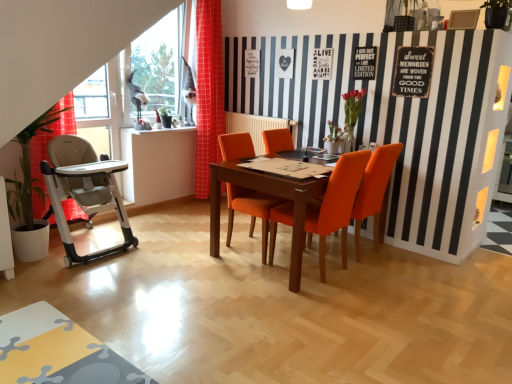
Question: Considering the relative sizes of orange fabric chair at center, the 3th chair positioned from the left, and red checkered curtain at left in the image provided, is orange fabric chair at center, the 3th chair positioned from the left, taller than red checkered curtain at left?

Choices:
 (A) yes
 (B) no

Answer: (B)

Question: Can you confirm if orange fabric chair at center, the 3th chair positioned from the left, is bigger than red checkered curtain at left?

Choices:
 (A) yes
 (B) no

Answer: (A)

Question: Considering the relative positions of orange fabric chair at center, which ranks as the first chair in right-to-left order, and red checkered curtain at left in the image provided, is orange fabric chair at center, which ranks as the first chair in right-to-left order, to the left of red checkered curtain at left from the viewer's perspective?

Choices:
 (A) no
 (B) yes

Answer: (A)

Question: Would you say orange fabric chair at center, the 3th chair positioned from the left, contains red checkered curtain at left?

Choices:
 (A) yes
 (B) no

Answer: (B)

Question: Can you confirm if orange fabric chair at center, which ranks as the first chair in right-to-left order, is thinner than red checkered curtain at left?

Choices:
 (A) yes
 (B) no

Answer: (B)

Question: From a real-world perspective, is orange fabric chair at center, which ranks as the first chair in right-to-left order, located higher than red checkered curtain at left?

Choices:
 (A) yes
 (B) no

Answer: (B)

Question: Considering the relative sizes of orange fabric chair at center, which ranks as the first chair in right-to-left order, and orange fabric chair at center, the second chair viewed from the left, in the image provided, is orange fabric chair at center, which ranks as the first chair in right-to-left order, bigger than orange fabric chair at center, the second chair viewed from the left,?

Choices:
 (A) yes
 (B) no

Answer: (B)

Question: Would you say orange fabric chair at center, the 3th chair positioned from the left, contains orange fabric chair at center, the second chair viewed from the left?

Choices:
 (A) no
 (B) yes

Answer: (A)

Question: From the image's perspective, is orange fabric chair at center, which ranks as the first chair in right-to-left order, below orange fabric chair at center, the second chair viewed from the left?

Choices:
 (A) no
 (B) yes

Answer: (A)

Question: Is orange fabric chair at center, which ranks as the first chair in right-to-left order, at the left side of orange fabric chair at center, which ranks as the 2th chair in right-to-left order?

Choices:
 (A) yes
 (B) no

Answer: (B)

Question: From a real-world perspective, is orange fabric chair at center, the 3th chair positioned from the left, on orange fabric chair at center, which ranks as the 2th chair in right-to-left order?

Choices:
 (A) yes
 (B) no

Answer: (A)

Question: Does orange fabric chair at center, the 3th chair positioned from the left, turn towards orange fabric chair at center, the second chair viewed from the left?

Choices:
 (A) no
 (B) yes

Answer: (A)

Question: From a real-world perspective, is orange fabric chair at center, which ranks as the first chair in right-to-left order, beneath green leafy plant at left?

Choices:
 (A) yes
 (B) no

Answer: (A)